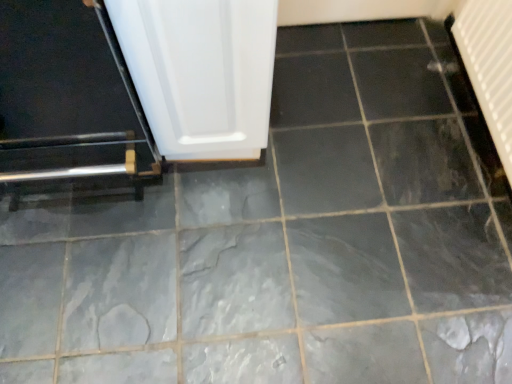
Question: Considering the relative sizes of white textured radiator at upper right and white glossy door at center in the image provided, is white textured radiator at upper right wider than white glossy door at center?

Choices:
 (A) yes
 (B) no

Answer: (B)

Question: Can you confirm if white textured radiator at upper right is positioned to the left of white glossy door at center?

Choices:
 (A) no
 (B) yes

Answer: (A)

Question: Is white textured radiator at upper right to the right of white glossy door at center from the viewer's perspective?

Choices:
 (A) no
 (B) yes

Answer: (B)

Question: From a real-world perspective, is white textured radiator at upper right on top of white glossy door at center?

Choices:
 (A) no
 (B) yes

Answer: (A)

Question: Could you tell me if white textured radiator at upper right is turned towards white glossy door at center?

Choices:
 (A) no
 (B) yes

Answer: (B)

Question: Is white textured radiator at upper right bigger than white glossy door at center?

Choices:
 (A) no
 (B) yes

Answer: (A)

Question: Is metallic silver door at left looking in the opposite direction of white glossy door at center?

Choices:
 (A) no
 (B) yes

Answer: (A)

Question: From the image's perspective, is metallic silver door at left located beneath white glossy door at center?

Choices:
 (A) no
 (B) yes

Answer: (B)

Question: Is metallic silver door at left not within white glossy door at center?

Choices:
 (A) yes
 (B) no

Answer: (A)

Question: Is metallic silver door at left smaller than white glossy door at center?

Choices:
 (A) no
 (B) yes

Answer: (A)

Question: Can you see metallic silver door at left touching white glossy door at center?

Choices:
 (A) no
 (B) yes

Answer: (A)

Question: Does metallic silver door at left have a lesser width compared to white glossy door at center?

Choices:
 (A) no
 (B) yes

Answer: (A)

Question: Does metallic silver door at left have a greater height compared to white textured radiator at upper right?

Choices:
 (A) yes
 (B) no

Answer: (A)